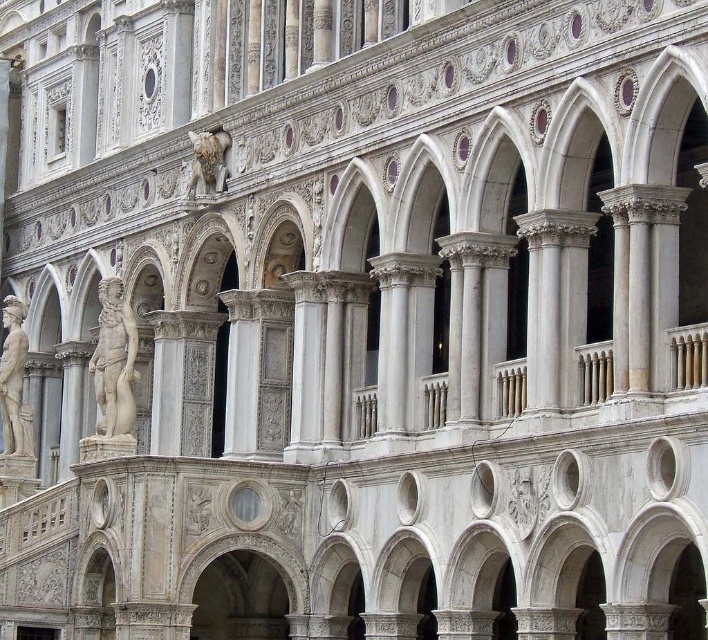
Question: Among these objects, which one is nearest to the camera?

Choices:
 (A) white marble statue at left
 (B) white marble statue at center

Answer: (B)

Question: Can you confirm if white marble statue at center is positioned to the right of polished stone lion at upper center?

Choices:
 (A) no
 (B) yes

Answer: (A)

Question: Is white marble statue at left thinner than polished stone lion at upper center?

Choices:
 (A) yes
 (B) no

Answer: (B)

Question: Is white marble statue at left thinner than polished stone lion at upper center?

Choices:
 (A) no
 (B) yes

Answer: (A)

Question: Which point is farther to the camera?

Choices:
 (A) white marble statue at center
 (B) white marble statue at left

Answer: (B)

Question: Considering the real-world distances, which object is farthest from the white marble statue at center?

Choices:
 (A) polished stone lion at upper center
 (B) white marble statue at left

Answer: (A)